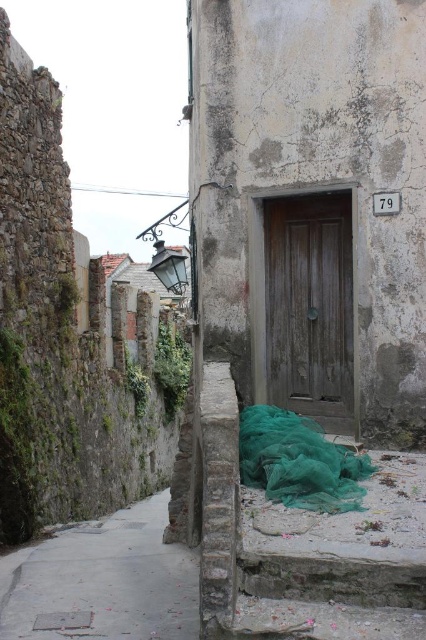
Question: Which of these objects is positioned farthest from the green mesh netting at lower center?

Choices:
 (A) concrete sidewalk at lower left
 (B) wooden door at center

Answer: (A)

Question: Estimate the real-world distances between objects in this image. Which object is farther from the green mesh netting at lower center?

Choices:
 (A) concrete sidewalk at lower left
 (B) wooden door at center

Answer: (A)

Question: Observing the image, what is the correct spatial positioning of concrete sidewalk at lower left in reference to green mesh netting at lower center?

Choices:
 (A) below
 (B) above

Answer: (A)

Question: Does concrete sidewalk at lower left appear on the right side of green mesh netting at lower center?

Choices:
 (A) yes
 (B) no

Answer: (B)

Question: Estimate the real-world distances between objects in this image. Which object is farther from the green mesh netting at lower center?

Choices:
 (A) concrete sidewalk at lower left
 (B) wooden door at center

Answer: (A)

Question: Can you confirm if concrete sidewalk at lower left is positioned to the right of wooden door at center?

Choices:
 (A) yes
 (B) no

Answer: (B)